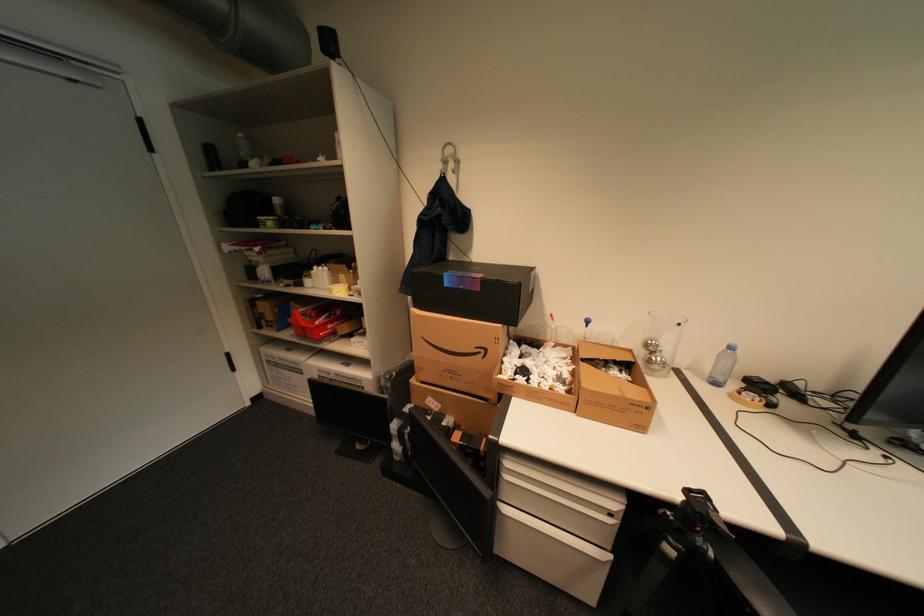
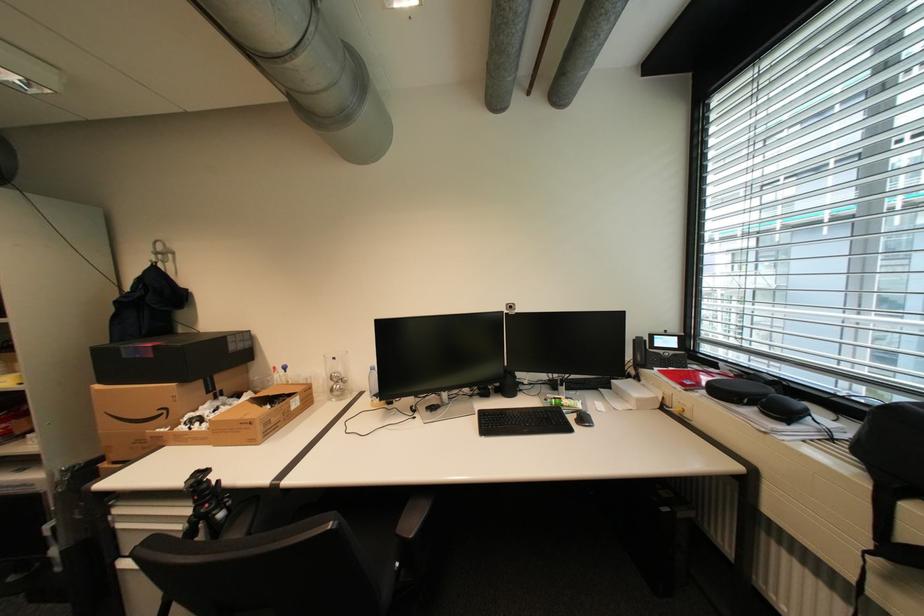
In the second image, find the point that corresponds to (x=492, y=352) in the first image.

(174, 411)